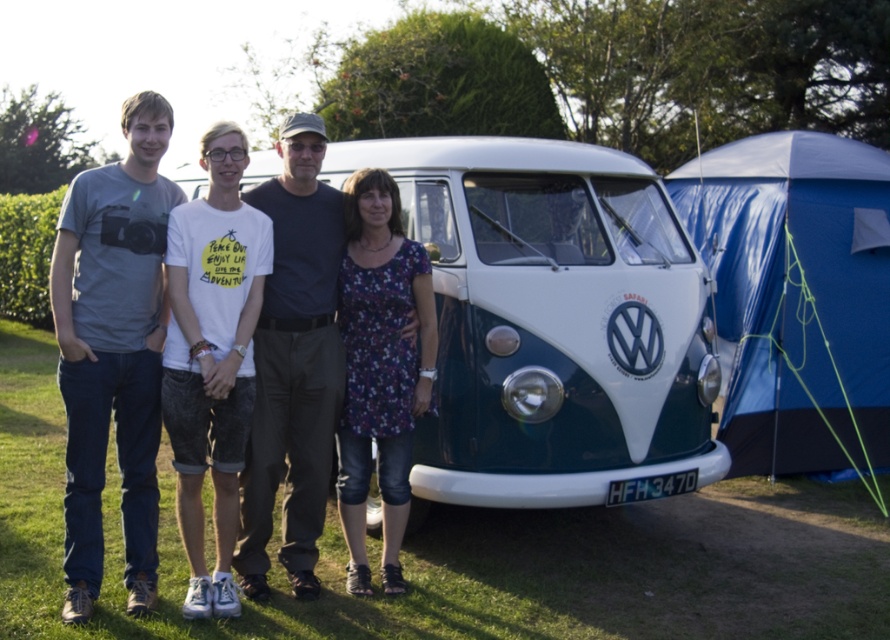
Question: Which object is farther from the camera taking this photo?

Choices:
 (A) matte gray t-shirt at left
 (B) blue tarpaulin tent at right
 (C) dark blue cotton shirt at center

Answer: (B)

Question: Is blue tarpaulin tent at right to the right of dark blue cotton shirt at center from the viewer's perspective?

Choices:
 (A) yes
 (B) no

Answer: (A)

Question: Can you confirm if white glossy van at center is positioned to the left of dark blue cotton shirt at center?

Choices:
 (A) no
 (B) yes

Answer: (A)

Question: Can you confirm if white cotton t-shirt at center is bigger than matte gray t-shirt at left?

Choices:
 (A) yes
 (B) no

Answer: (A)

Question: Which of the following is the closest to the observer?

Choices:
 (A) (449, 316)
 (B) (282, 122)
 (C) (216, 321)
 (D) (101, 484)

Answer: (C)

Question: Among these points, which one is farthest from the camera?

Choices:
 (A) (176, 433)
 (B) (842, 259)
 (C) (127, 410)

Answer: (B)